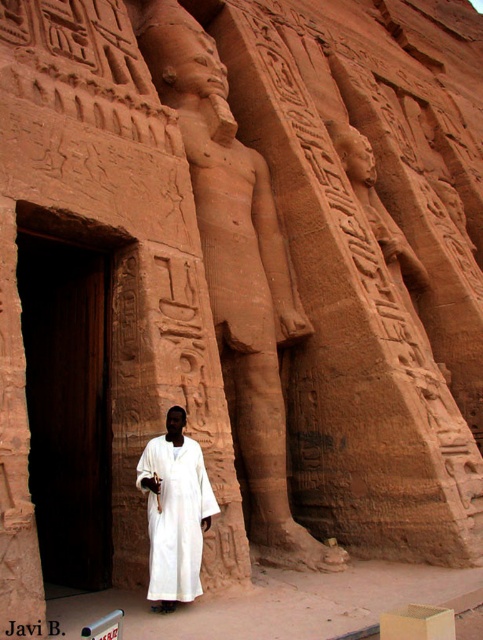
Measure the distance from dark wood door at left to white cotton robe at center.

dark wood door at left is 32.32 feet away from white cotton robe at center.

Is dark wood door at left smaller than white cotton robe at center?

Incorrect, dark wood door at left is not smaller in size than white cotton robe at center.

Who is more forward, (98,428) or (182,515)?

Positioned in front is point (182,515).

You are a GUI agent. You are given a task and a screenshot of the screen. Output one action in this format:
    pyautogui.click(x=<x>, y=<y>)
    Task: Click on the dark wood door at left
    
    Given the screenshot: What is the action you would take?
    pyautogui.click(x=68, y=404)